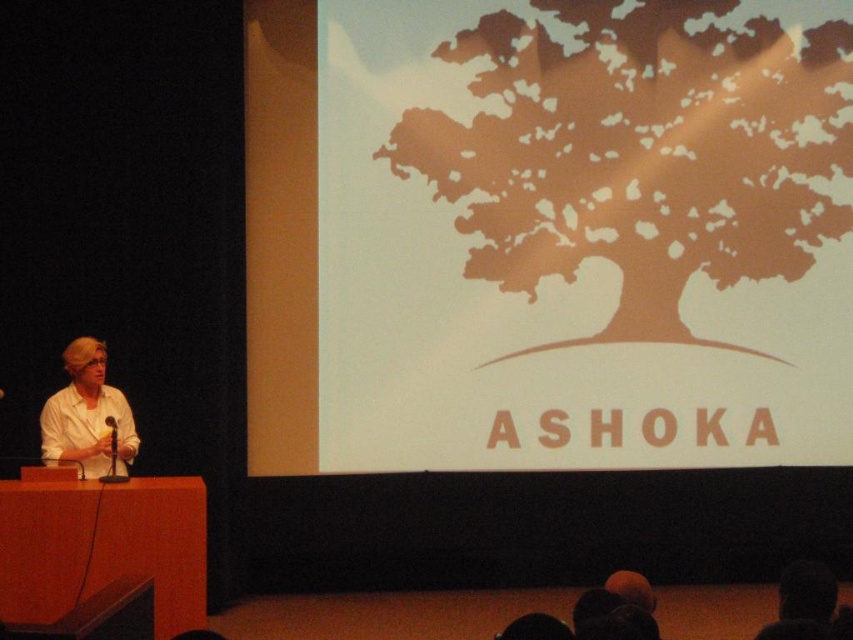
Question: Where is brown paper tree at upper center located in relation to black matte microphone at left in the image?

Choices:
 (A) above
 (B) below

Answer: (A)

Question: Is brown paper tree at upper center smaller than white matte shirt at left?

Choices:
 (A) no
 (B) yes

Answer: (A)

Question: Does brown paper tree at upper center have a smaller size compared to black matte microphone at left?

Choices:
 (A) no
 (B) yes

Answer: (A)

Question: Estimate the real-world distances between objects in this image. Which object is farther from the white matte shirt at left?

Choices:
 (A) black matte microphone at left
 (B) brown paper tree at upper center

Answer: (B)

Question: Which of the following is the closest to the observer?

Choices:
 (A) black matte microphone at left
 (B) white matte shirt at left
 (C) brown paper tree at upper center

Answer: (A)

Question: Among these objects, which one is farthest from the camera?

Choices:
 (A) brown paper tree at upper center
 (B) black matte microphone at left
 (C) white matte shirt at left

Answer: (A)